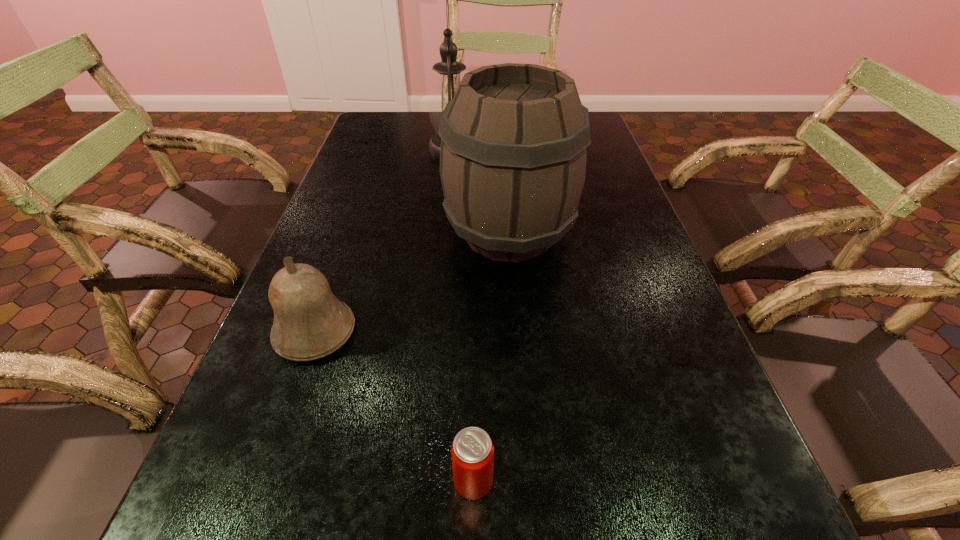
This screenshot has width=960, height=540. I want to click on free point between the farthest object and the bell, so coord(384,240).

You are a GUI agent. You are given a task and a screenshot of the screen. Output one action in this format:
    pyautogui.click(x=<x>, y=<y>)
    Task: Click on the free space between the wine bucket and the leftmost object
    
    Given the screenshot: What is the action you would take?
    pyautogui.click(x=412, y=282)

The width and height of the screenshot is (960, 540). Find the location of `the third closest object to the oil lamp`. the third closest object to the oil lamp is located at coordinates (472, 451).

Locate which object ranks second in proximity to the shortest object. Please provide its 2D coordinates. Your answer should be formatted as a tuple, i.e. [(x, y)], where the tuple contains the x and y coordinates of a point satisfying the conditions above.

[(513, 154)]